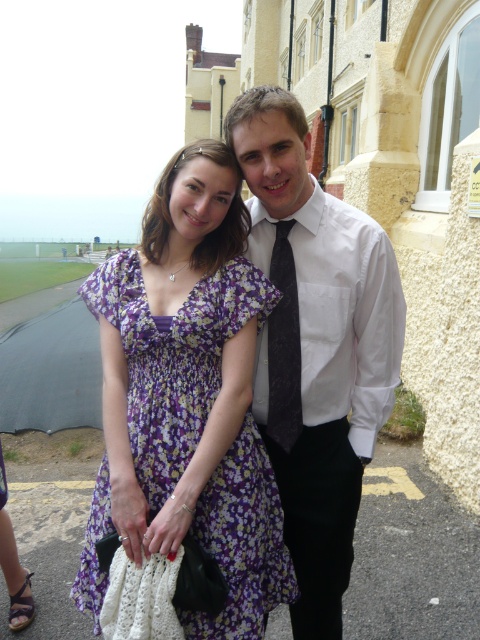
Is white smooth shirt at center to the right of floral fabric dress at center from the viewer's perspective?

Correct, you'll find white smooth shirt at center to the right of floral fabric dress at center.

Is white smooth shirt at center closer to the viewer compared to floral fabric dress at center?

No, it is behind floral fabric dress at center.

At what (x,y) coordinates should I click in order to perform the action: click on white smooth shirt at center. Please return your answer as a coordinate pair (x, y). The height and width of the screenshot is (640, 480). Looking at the image, I should click on (315, 346).

Is white smooth shirt at center taller than dark gray textured tie at center?

Yes, white smooth shirt at center is taller than dark gray textured tie at center.

Looking at this image, which is more to the right, white smooth shirt at center or dark gray textured tie at center?

white smooth shirt at center is more to the right.

Is point (241, 132) farther from camera compared to point (273, 394)?

No, it is not.

Image resolution: width=480 pixels, height=640 pixels. I want to click on white smooth shirt at center, so click(x=315, y=346).

Who is more forward, (177, 369) or (277, 380)?

Point (177, 369) is more forward.

Image resolution: width=480 pixels, height=640 pixels. I want to click on floral fabric dress at center, so click(x=172, y=356).